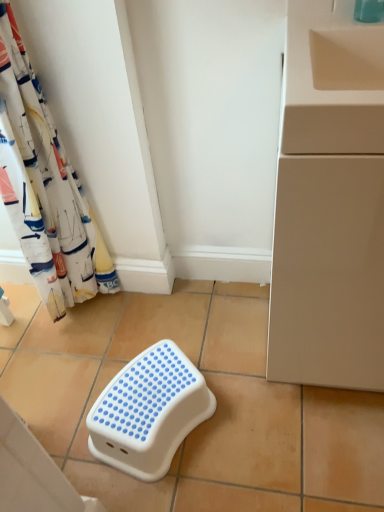
Question: From the image's perspective, is beige matte cabinet at right located beneath white fabric curtain at left?

Choices:
 (A) yes
 (B) no

Answer: (A)

Question: Can you confirm if beige matte cabinet at right is thinner than white fabric curtain at left?

Choices:
 (A) yes
 (B) no

Answer: (B)

Question: Is beige matte cabinet at right directly adjacent to white fabric curtain at left?

Choices:
 (A) no
 (B) yes

Answer: (A)

Question: From a real-world perspective, is beige matte cabinet at right physically below white fabric curtain at left?

Choices:
 (A) yes
 (B) no

Answer: (A)

Question: Is beige matte cabinet at right further to camera compared to white fabric curtain at left?

Choices:
 (A) yes
 (B) no

Answer: (B)

Question: Would you consider beige matte cabinet at right to be distant from white fabric curtain at left?

Choices:
 (A) yes
 (B) no

Answer: (B)

Question: Is beige ceramic tile at lower left, placed as the 1th ceramic tile when sorted from left to right, facing away from white plastic step stool at center, which is the 2th ceramic tile from left to right?

Choices:
 (A) no
 (B) yes

Answer: (A)

Question: Can you confirm if beige ceramic tile at lower left, placed as the 1th ceramic tile when sorted from left to right, is bigger than white plastic step stool at center, the first ceramic tile viewed from the right?

Choices:
 (A) yes
 (B) no

Answer: (B)

Question: Considering the relative sizes of beige ceramic tile at lower left, acting as the 2th ceramic tile starting from the right, and white plastic step stool at center, which is the 2th ceramic tile from left to right, in the image provided, is beige ceramic tile at lower left, acting as the 2th ceramic tile starting from the right, taller than white plastic step stool at center, which is the 2th ceramic tile from left to right,?

Choices:
 (A) no
 (B) yes

Answer: (B)

Question: Considering the relative sizes of beige ceramic tile at lower left, acting as the 2th ceramic tile starting from the right, and white plastic step stool at center, the first ceramic tile viewed from the right, in the image provided, is beige ceramic tile at lower left, acting as the 2th ceramic tile starting from the right, smaller than white plastic step stool at center, the first ceramic tile viewed from the right,?

Choices:
 (A) yes
 (B) no

Answer: (A)

Question: Is beige ceramic tile at lower left, acting as the 2th ceramic tile starting from the right, at the left side of white plastic step stool at center, which is the 2th ceramic tile from left to right?

Choices:
 (A) yes
 (B) no

Answer: (A)

Question: Is beige ceramic tile at lower left, acting as the 2th ceramic tile starting from the right, with white plastic step stool at center, the first ceramic tile viewed from the right?

Choices:
 (A) yes
 (B) no

Answer: (B)

Question: Can white plastic step stool at center be found inside white fabric curtain at left?

Choices:
 (A) yes
 (B) no

Answer: (B)